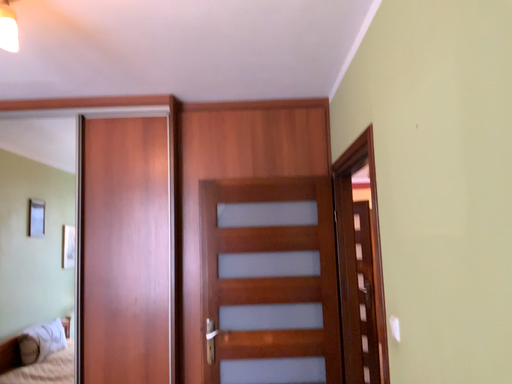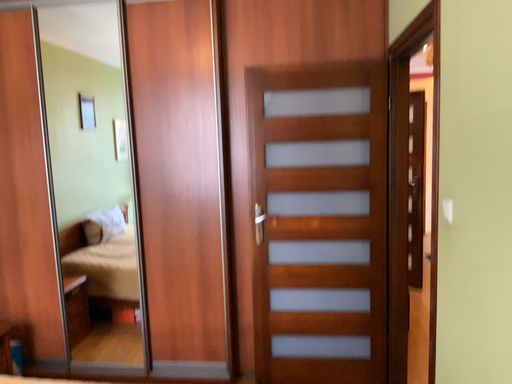
Question: Which way did the camera rotate in the video?

Choices:
 (A) rotated downward
 (B) rotated upward

Answer: (A)